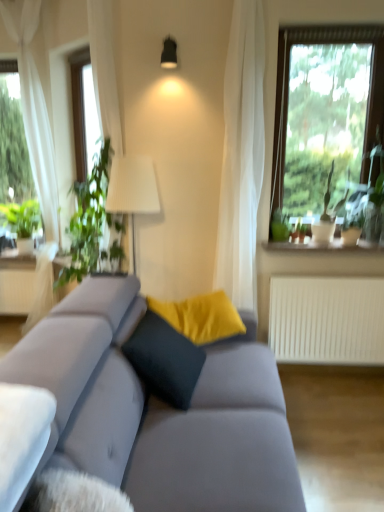
Question: Are white sheer curtain at left and white ceramic vase at upper right located far from each other?

Choices:
 (A) yes
 (B) no

Answer: (A)

Question: From a real-world perspective, is white sheer curtain at left located higher than white ceramic vase at upper right?

Choices:
 (A) yes
 (B) no

Answer: (A)

Question: From the image's perspective, is white sheer curtain at left located beneath white ceramic vase at upper right?

Choices:
 (A) yes
 (B) no

Answer: (B)

Question: Is white sheer curtain at left completely or partially outside of white ceramic vase at upper right?

Choices:
 (A) yes
 (B) no

Answer: (A)

Question: Is white sheer curtain at left taller than white ceramic vase at upper right?

Choices:
 (A) yes
 (B) no

Answer: (A)

Question: Considering the relative positions of suede gray couch at center and white ceramic vase at upper right in the image provided, is suede gray couch at center to the left or to the right of white ceramic vase at upper right?

Choices:
 (A) right
 (B) left

Answer: (B)

Question: Is point (94, 467) positioned closer to the camera than point (360, 248)?

Choices:
 (A) farther
 (B) closer

Answer: (B)

Question: From a real-world perspective, is suede gray couch at center positioned above or below white ceramic vase at upper right?

Choices:
 (A) below
 (B) above

Answer: (A)

Question: Is suede gray couch at center spatially inside white ceramic vase at upper right, or outside of it?

Choices:
 (A) outside
 (B) inside

Answer: (A)

Question: From the image's perspective, is suede gray couch at center positioned above or below green leafy plant at left?

Choices:
 (A) below
 (B) above

Answer: (A)

Question: Is suede gray couch at center taller or shorter than green leafy plant at left?

Choices:
 (A) short
 (B) tall

Answer: (A)

Question: Which is correct: suede gray couch at center is inside green leafy plant at left, or outside of it?

Choices:
 (A) outside
 (B) inside

Answer: (A)

Question: From a real-world perspective, relative to green leafy plant at left, is suede gray couch at center vertically above or below?

Choices:
 (A) below
 (B) above

Answer: (A)

Question: Is white ceramic vase at upper right to the left or to the right of suede gray couch at center in the image?

Choices:
 (A) right
 (B) left

Answer: (A)

Question: Considering the positions of white ceramic vase at upper right and suede gray couch at center in the image, is white ceramic vase at upper right wider or thinner than suede gray couch at center?

Choices:
 (A) wide
 (B) thin

Answer: (B)